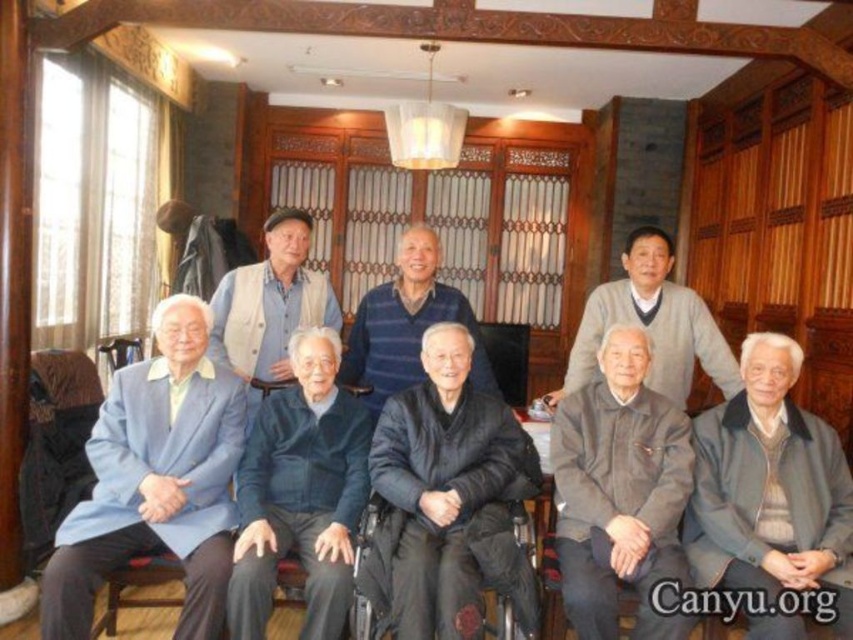
You are a photographer setting up for a group photo. You need to ensure that the light blue fabric suit at lower left and the dark blue sweater at center are both visible in the frame. Based on their positions, which one is closer to the camera?

The light blue fabric suit at lower left is located below the dark blue sweater at center, meaning it is closer to the camera.

You are organizing a photo shoot and need to ensure that all participants are visible in the frame. Given that the dark gray fabric jacket at lower center and the dark gray fabric wheelchair at lower center are both at the same position, which object would block the view of the other if placed in front?

The dark gray fabric jacket at lower center has a larger size compared to the dark gray fabric wheelchair at lower center, so if placed in front, it would block the view of the wheelchair.